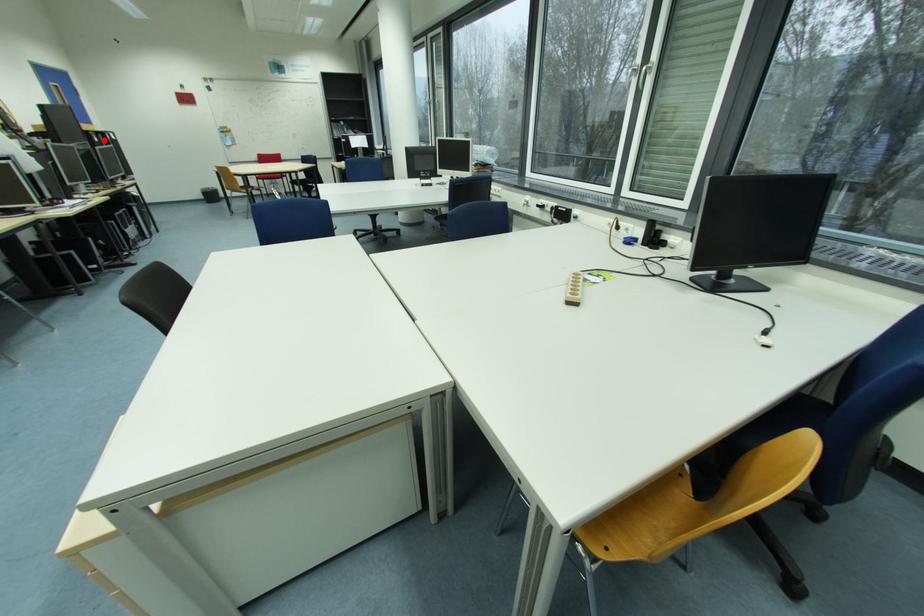
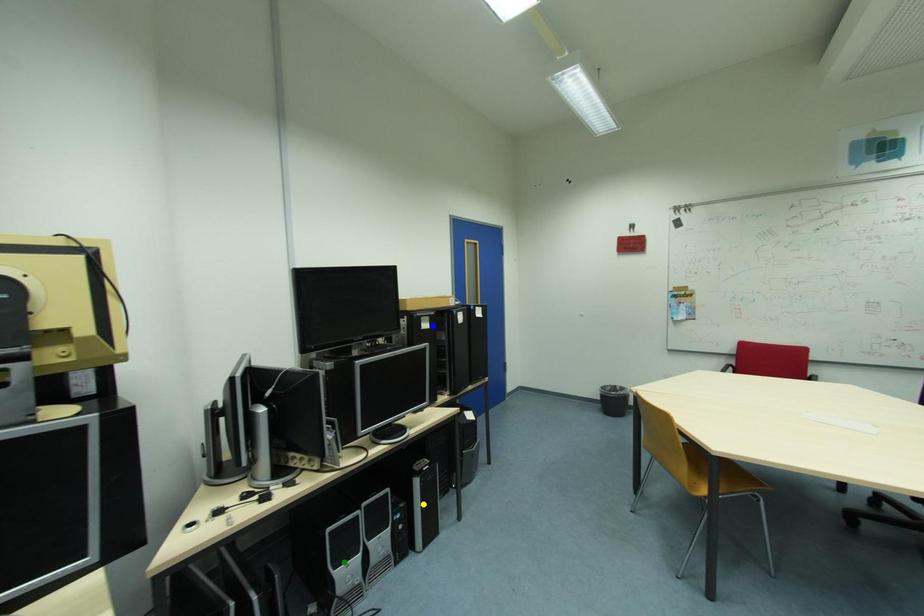
Question: I am providing you with two images of the same scene from different viewpoints. A red point is marked on the first image. You are given multiple points on the second image. Which spot in image 2 lines up with the point in image 1?

Choices:
 (A) green point
 (B) yellow point
 (C) blue point

Answer: (C)